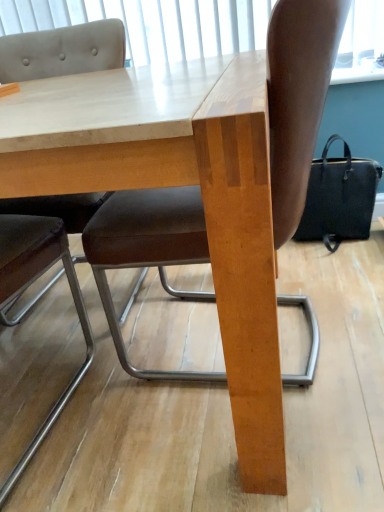
Question: Should I look upward or downward to see black fabric bag at right?

Choices:
 (A) down
 (B) up

Answer: (B)

Question: Can you confirm if white matte window screen at upper center is wider than brown leather chair at center, the 1th chair positioned from the right?

Choices:
 (A) yes
 (B) no

Answer: (B)

Question: Does white matte window screen at upper center contain brown leather chair at center, arranged as the second chair when viewed from the left?

Choices:
 (A) yes
 (B) no

Answer: (B)

Question: Is white matte window screen at upper center taller than brown leather chair at center, arranged as the second chair when viewed from the left?

Choices:
 (A) no
 (B) yes

Answer: (A)

Question: Can we say white matte window screen at upper center lies outside brown leather chair at center, arranged as the second chair when viewed from the left?

Choices:
 (A) yes
 (B) no

Answer: (A)

Question: Is white matte window screen at upper center at the left side of brown leather chair at center, arranged as the second chair when viewed from the left?

Choices:
 (A) yes
 (B) no

Answer: (A)

Question: From a real-world perspective, is white matte window screen at upper center positioned over brown leather chair at center, the 1th chair positioned from the right, based on gravity?

Choices:
 (A) no
 (B) yes

Answer: (B)

Question: Is black fabric bag at right further to the viewer compared to brown leather chair at center, arranged as the second chair when viewed from the left?

Choices:
 (A) no
 (B) yes

Answer: (B)

Question: Does black fabric bag at right have a lesser width compared to brown leather chair at center, the 1th chair positioned from the right?

Choices:
 (A) no
 (B) yes

Answer: (B)

Question: Can you confirm if black fabric bag at right is positioned to the left of brown leather chair at center, arranged as the second chair when viewed from the left?

Choices:
 (A) yes
 (B) no

Answer: (B)

Question: From a real-world perspective, does black fabric bag at right stand above brown leather chair at center, arranged as the second chair when viewed from the left?

Choices:
 (A) no
 (B) yes

Answer: (A)

Question: Considering the relative positions of black fabric bag at right and brown leather chair at center, arranged as the second chair when viewed from the left, in the image provided, is black fabric bag at right in front of brown leather chair at center, arranged as the second chair when viewed from the left,?

Choices:
 (A) no
 (B) yes

Answer: (A)

Question: Is black fabric bag at right far from brown leather chair at center, arranged as the second chair when viewed from the left?

Choices:
 (A) no
 (B) yes

Answer: (A)

Question: Does brown leather chair at center, the 1th chair positioned from the right, have a lesser height compared to black fabric bag at right?

Choices:
 (A) yes
 (B) no

Answer: (B)